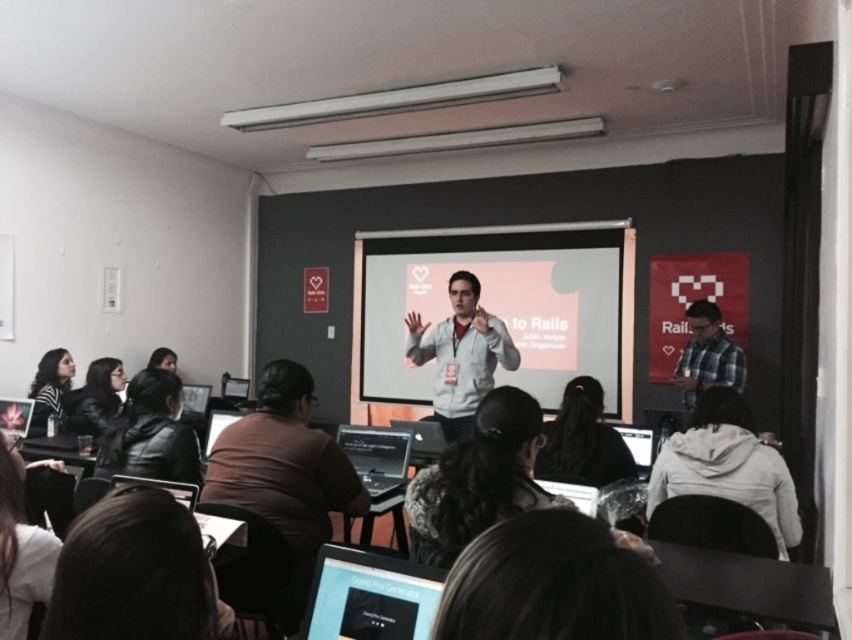
Is white matte projector screen at center to the right of black leather jacket at lower left from the viewer's perspective?

Indeed, white matte projector screen at center is positioned on the right side of black leather jacket at lower left.

Is white matte projector screen at center behind black leather jacket at lower left?

Yes, it is.

Is point (557, 332) less distant than point (125, 403)?

No.

The width and height of the screenshot is (852, 640). Identify the location of white matte projector screen at center. (499, 305).

Can you confirm if brown leather jacket at lower left is smaller than brown leather jacket at center?

Correct, brown leather jacket at lower left occupies less space than brown leather jacket at center.

Who is more forward, (171, 621) or (324, 486)?

Positioned in front is point (171, 621).

Does point (157, 536) come closer to viewer compared to point (281, 476)?

That is True.

What are the coordinates of `brown leather jacket at lower left` in the screenshot? It's located at (134, 573).

Does white matte projector screen at center appear on the right side of brown leather jacket at lower left?

Indeed, white matte projector screen at center is positioned on the right side of brown leather jacket at lower left.

You are a GUI agent. You are given a task and a screenshot of the screen. Output one action in this format:
    pyautogui.click(x=<x>, y=<y>)
    Task: Click on the white matte projector screen at center
    The width and height of the screenshot is (852, 640).
    Given the screenshot: What is the action you would take?
    pyautogui.click(x=499, y=305)